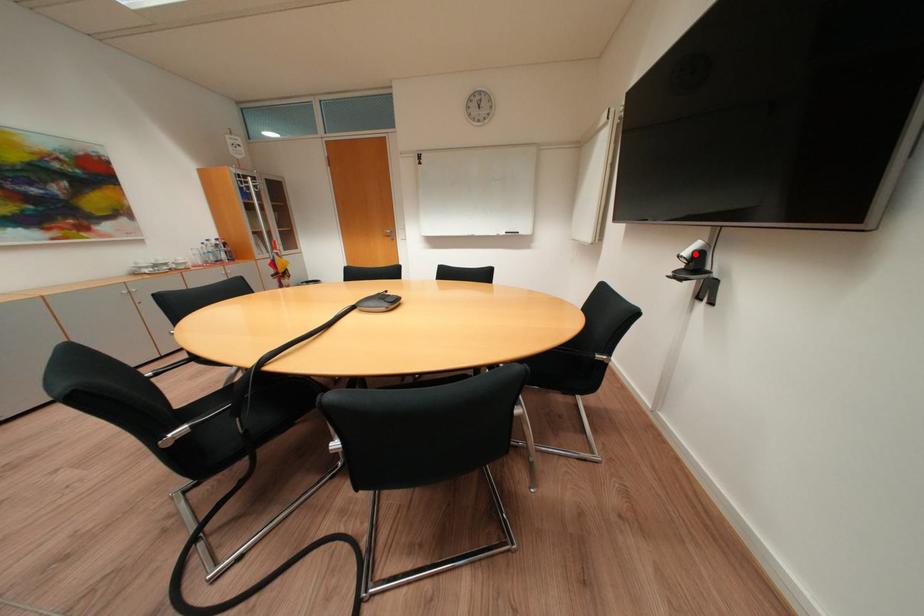
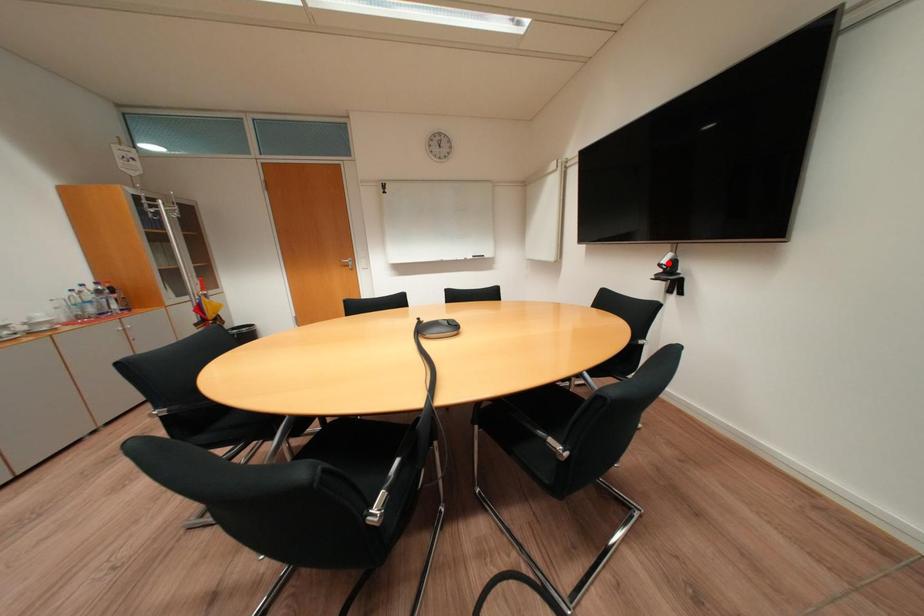
I am providing you with two images of the same scene from different viewpoints. A red point is marked on the first image and another point is marked on the second image. Is the red point in image1 aligned with the point shown in image2?

No